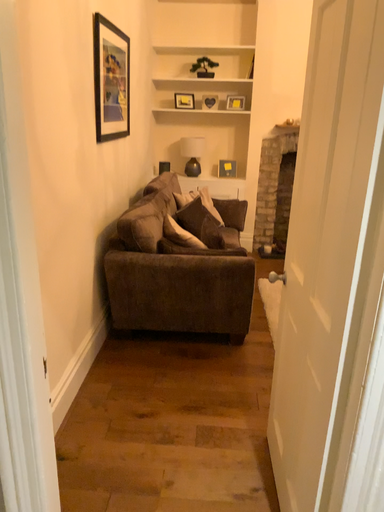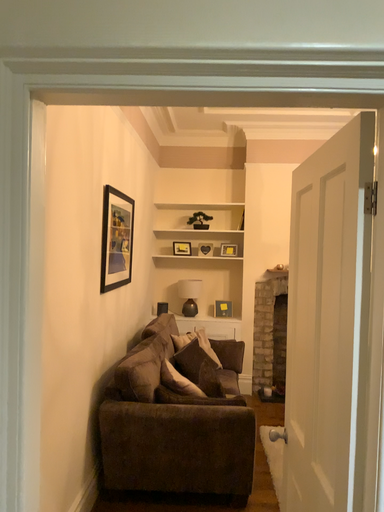
Question: Which way did the camera rotate in the video?

Choices:
 (A) rotated downward
 (B) rotated upward

Answer: (B)